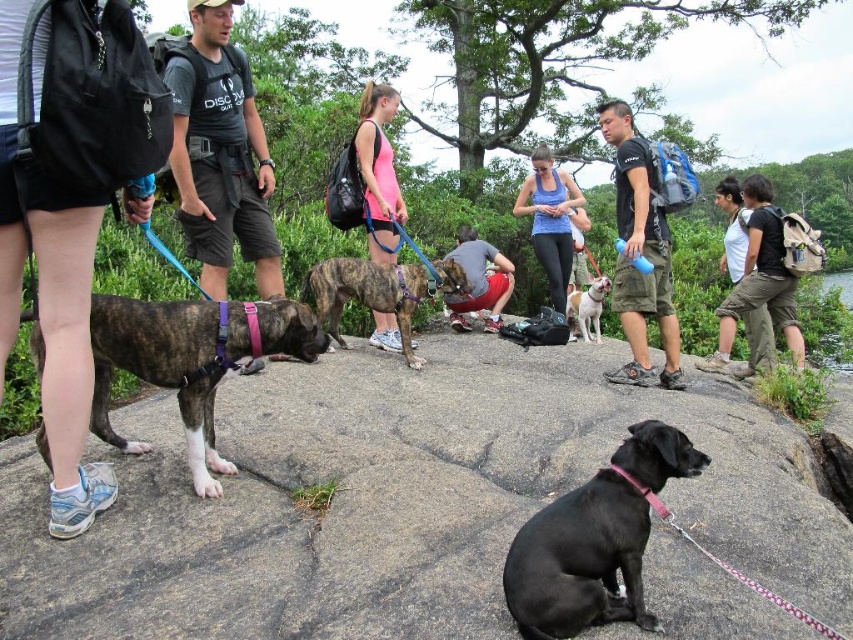
Question: From the image, what is the correct spatial relationship of black matte shirt at center in relation to blue fabric tank top at center?

Choices:
 (A) below
 (B) above

Answer: (A)

Question: Is brindle fur dog at center further to the viewer compared to braided leather leash at center?

Choices:
 (A) yes
 (B) no

Answer: (B)

Question: Which point is closer to the camera?

Choices:
 (A) (601, 282)
 (B) (635, 184)
 (C) (670, 516)

Answer: (C)

Question: Which point is farther to the camera?

Choices:
 (A) [175, 340]
 (B) [583, 332]
 (C) [627, 554]
 (D) [496, 273]

Answer: (D)

Question: Based on their relative distances, which object is nearer to the white smooth dog at center?

Choices:
 (A) matte black tank top at center
 (B) pink fabric leash at lower center

Answer: (A)

Question: In this image, where is matte black shorts at left located relative to pink fabric tank top at center?

Choices:
 (A) right
 (B) left

Answer: (B)